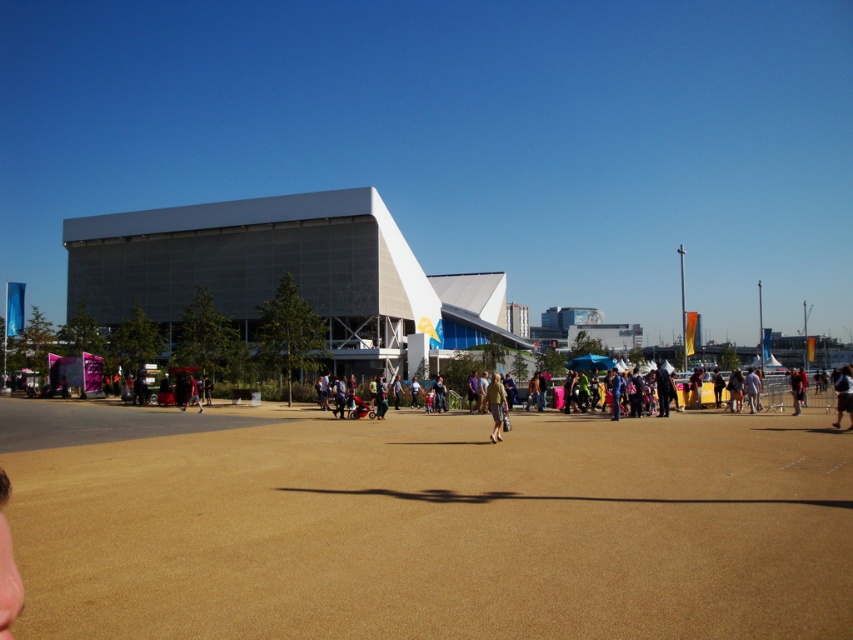
Can you confirm if khaki fabric pants at center is positioned to the left of dark blue jeans at lower right?

Correct, you'll find khaki fabric pants at center to the left of dark blue jeans at lower right.

Does khaki fabric pants at center have a greater height compared to dark blue jeans at lower right?

Incorrect, khaki fabric pants at center's height is not larger of dark blue jeans at lower right's.

Is point (500, 387) closer to camera compared to point (848, 392)?

Yes, point (500, 387) is in front of point (848, 392).

Locate an element on the screen. The width and height of the screenshot is (853, 640). khaki fabric pants at center is located at coordinates (495, 404).

Who is lower down, gray metallic building at center or khaki fabric pants at center?

khaki fabric pants at center

Is gray metallic building at center bigger than khaki fabric pants at center?

Correct, gray metallic building at center is larger in size than khaki fabric pants at center.

What do you see at coordinates (286, 272) in the screenshot? This screenshot has height=640, width=853. I see `gray metallic building at center` at bounding box center [286, 272].

The width and height of the screenshot is (853, 640). In order to click on gray metallic building at center in this screenshot , I will do `click(286, 272)`.

Does brown textured dirt field at center have a smaller size compared to gray metallic building at center?

Correct, brown textured dirt field at center occupies less space than gray metallic building at center.

Does brown textured dirt field at center appear under gray metallic building at center?

Correct, brown textured dirt field at center is located below gray metallic building at center.

Is point (706, 449) closer to camera compared to point (62, 228)?

Yes, it is.

At what (x,y) coordinates should I click in order to perform the action: click on brown textured dirt field at center. Please return your answer as a coordinate pair (x, y). Looking at the image, I should click on (428, 525).